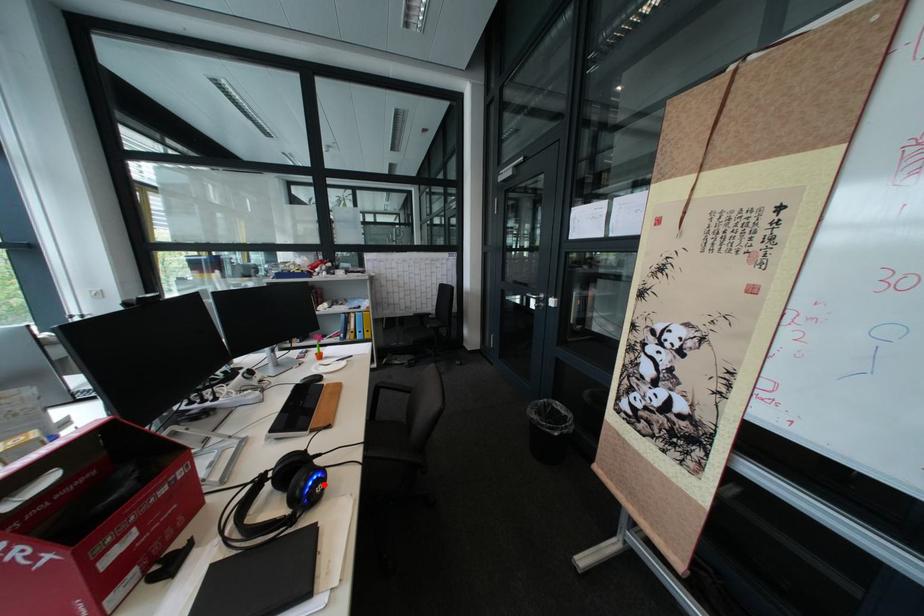
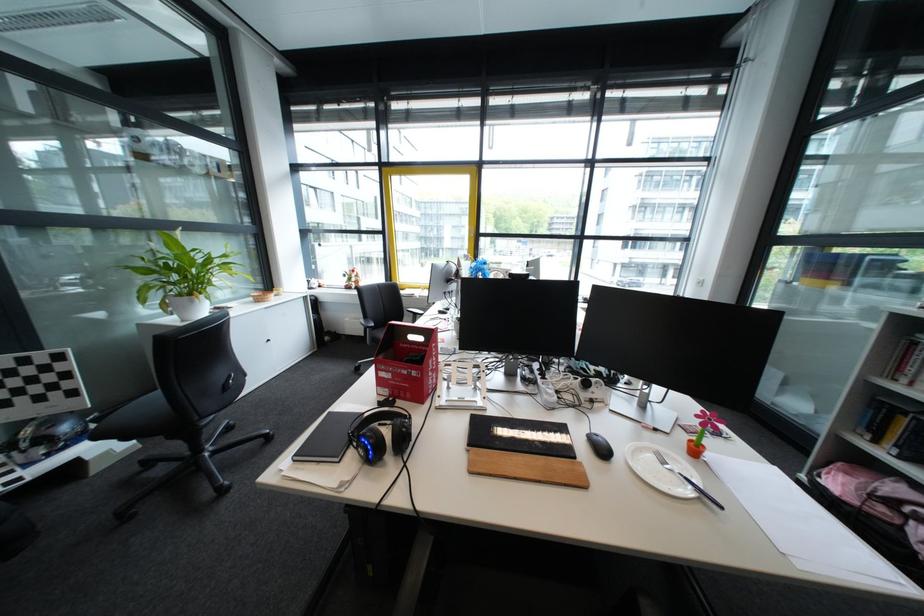
Find the pixel in the second image that matches the highlighted location in the first image.

(378, 440)